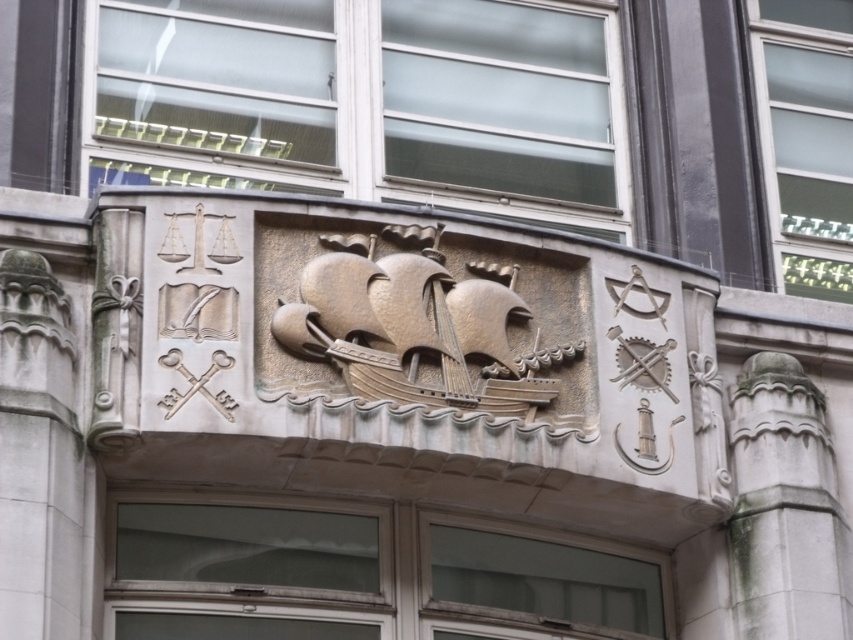
You are an architect analyzing this building facade. You notice two points marked on the relief sculpture. The first point is at coordinates point (514, 538) and the second is at point (798, 595). Based on their positions, which point is closer to you as you face the facade?

Point (514, 538) is closer to you than point (798, 595) because it is further to the viewer according to the description.